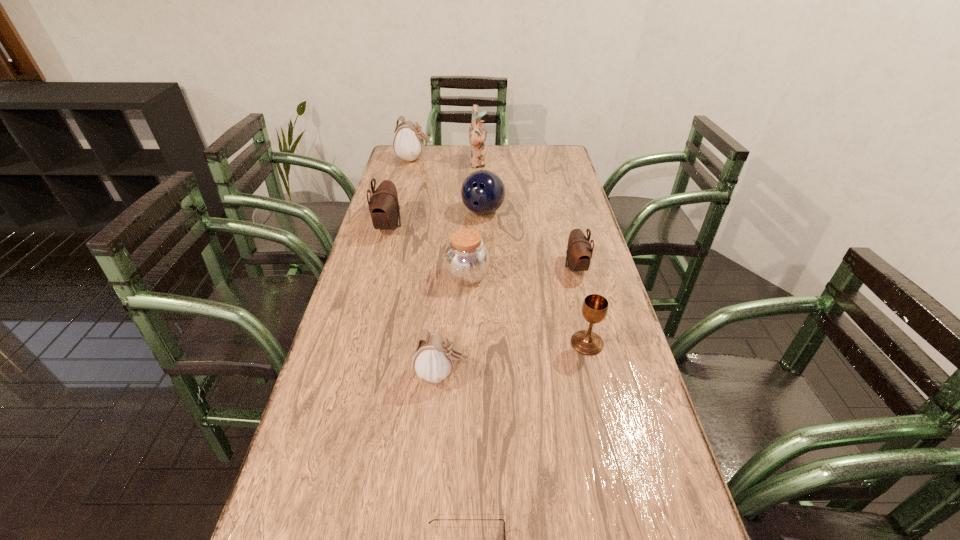
In the image, there is a desktop. What are the coordinates of `vacant space at the right edge` in the screenshot? It's located at (646, 488).

Locate an element on the screen. This screenshot has width=960, height=540. free region at the far right corner of the desktop is located at coordinates (551, 160).

The height and width of the screenshot is (540, 960). I want to click on empty space that is in between the third nearest pouch and the third pouch from left to right, so click(x=415, y=300).

Find the location of a particular element. The height and width of the screenshot is (540, 960). vacant region between the left white pouch and the brown jar is located at coordinates (441, 218).

You are a GUI agent. You are given a task and a screenshot of the screen. Output one action in this format:
    pyautogui.click(x=<x>, y=<y>)
    Task: Click on the vacant space that's between the right white pouch and the smaller brown pouch
    This screenshot has height=540, width=960.
    Given the screenshot: What is the action you would take?
    tap(509, 320)

Locate an element on the screen. The height and width of the screenshot is (540, 960). vacant point located between the farther white pouch and the eighth farthest object is located at coordinates (427, 266).

The image size is (960, 540). I want to click on free spot between the farther white pouch and the tallest object, so click(x=446, y=161).

Identify the location of vacant area between the figurine and the farther white pouch. Image resolution: width=960 pixels, height=540 pixels. (446, 161).

What are the coordinates of `free space that is in between the brown jar and the eighth farthest object` in the screenshot? It's located at (454, 325).

At what (x,y) coordinates should I click in order to perform the action: click on free space between the brown jar and the tallest object. Please return your answer as a coordinate pair (x, y). Looking at the image, I should click on (472, 220).